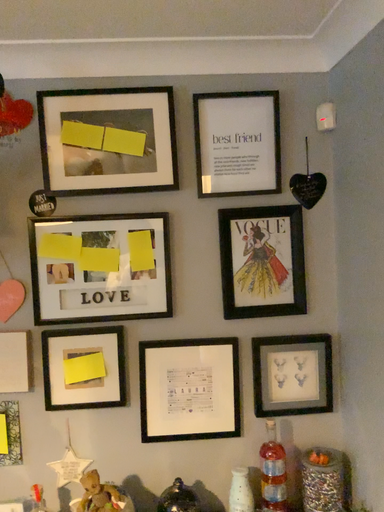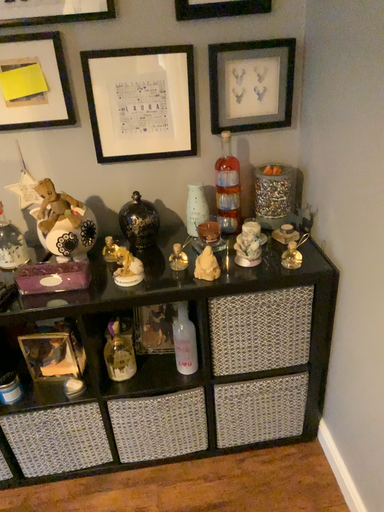
Question: Which way did the camera rotate in the video?

Choices:
 (A) rotated upward
 (B) rotated downward

Answer: (B)